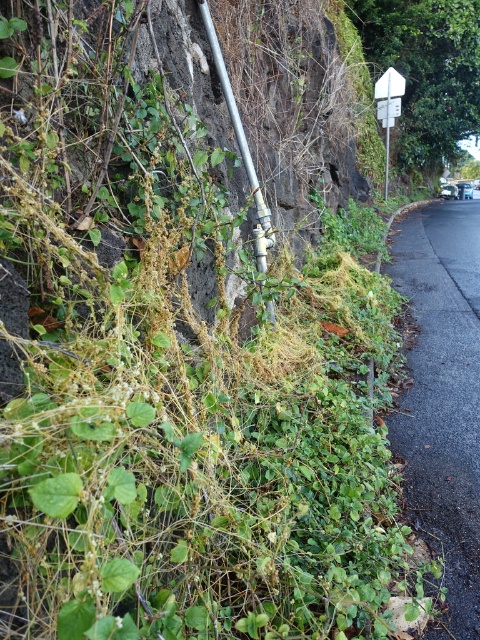
Question: Which point is farther to the camera?

Choices:
 (A) (393, 106)
 (B) (238, 113)

Answer: (A)

Question: Which of the following is the farthest from the observer?

Choices:
 (A) white plastic sign at upper right
 (B) metallic pipe at center

Answer: (A)

Question: Is metallic pipe at center to the right of white plastic sign at upper right from the viewer's perspective?

Choices:
 (A) no
 (B) yes

Answer: (A)

Question: Considering the relative positions of metallic pipe at center and white plastic sign at upper right in the image provided, where is metallic pipe at center located with respect to white plastic sign at upper right?

Choices:
 (A) above
 (B) below

Answer: (B)

Question: Is metallic pipe at center to the right of white plastic sign at upper right from the viewer's perspective?

Choices:
 (A) yes
 (B) no

Answer: (B)